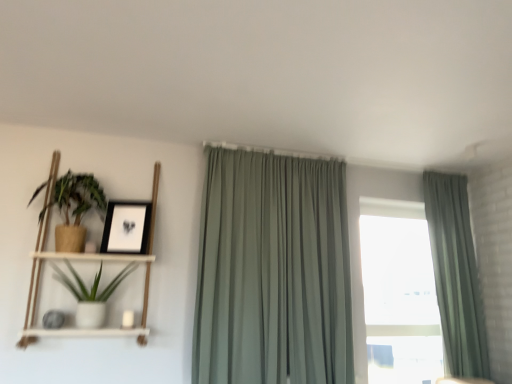
The height and width of the screenshot is (384, 512). What do you see at coordinates (126, 227) in the screenshot?
I see `matte black picture frame at upper left` at bounding box center [126, 227].

Measure the distance between matte brown pot at left, the 2th houseplant from the bottom, and camera.

matte brown pot at left, the 2th houseplant from the bottom, and camera are 8.24 feet apart.

Consider the image. In order to face white wood shelf at left, should I rotate leftwards or rightwards?

A 20.363 degree turn to the left will do.

The image size is (512, 384). I want to click on sage green fabric curtain at right, which is counted as the first curtain, starting from the right, so click(456, 275).

The height and width of the screenshot is (384, 512). Describe the element at coordinates (273, 272) in the screenshot. I see `sage green fabric curtain at center, acting as the second curtain starting from the right` at that location.

Image resolution: width=512 pixels, height=384 pixels. In order to click on sage green fabric curtain at center, acting as the second curtain starting from the right in this screenshot , I will do `click(273, 272)`.

I want to click on white matte pot at left, the 1th houseplant positioned from the bottom, so click(x=91, y=294).

Where is `matte black picture frame at upper left`? matte black picture frame at upper left is located at coordinates (126, 227).

From the picture: Is matte brown pot at left, positioned as the first houseplant in top-to-bottom order, oriented towards white wood shelf at left?

Yes.

At what (x,y) coordinates should I click in order to perform the action: click on shelf in front of the matte brown pot at left, positioned as the first houseplant in top-to-bottom order. Please return your answer as a coordinate pair (x, y). Looking at the image, I should click on (87, 260).

Considering the positions of point (78, 204) and point (99, 259), is point (78, 204) closer or farther from the camera than point (99, 259)?

Point (78, 204) is positioned farther from the camera compared to point (99, 259).

Considering the relative positions of matte brown pot at left, positioned as the first houseplant in top-to-bottom order, and white wood shelf at left in the image provided, is matte brown pot at left, positioned as the first houseplant in top-to-bottom order, to the right of white wood shelf at left from the viewer's perspective?

No.

Between matte brown pot at left, the 2th houseplant from the bottom, and sage green fabric curtain at right, which is counted as the first curtain, starting from the right, which one has less height?

Standing shorter between the two is matte brown pot at left, the 2th houseplant from the bottom.

Does matte brown pot at left, the 2th houseplant from the bottom, have a lesser width compared to sage green fabric curtain at right, which is counted as the first curtain, starting from the right?

In fact, matte brown pot at left, the 2th houseplant from the bottom, might be wider than sage green fabric curtain at right, which is counted as the first curtain, starting from the right.

Would you consider matte brown pot at left, positioned as the first houseplant in top-to-bottom order, to be distant from sage green fabric curtain at right, which is counted as the first curtain, starting from the right?

matte brown pot at left, positioned as the first houseplant in top-to-bottom order, is far away from sage green fabric curtain at right, which is counted as the first curtain, starting from the right.

Is sage green fabric curtain at right, which is counted as the first curtain, starting from the right, surrounded by matte brown pot at left, the 2th houseplant from the bottom?

No, sage green fabric curtain at right, which is counted as the first curtain, starting from the right, is not surrounded by matte brown pot at left, the 2th houseplant from the bottom.

From the image's perspective, between white matte pot at left, the 1th houseplant positioned from the bottom, and sage green fabric curtain at center, acting as the first curtain starting from the left, which one is located above?

sage green fabric curtain at center, acting as the first curtain starting from the left, is shown above in the image.

Is white matte pot at left, the 1th houseplant positioned from the bottom, oriented away from sage green fabric curtain at center, acting as the second curtain starting from the right?

No, white matte pot at left, the 1th houseplant positioned from the bottom, is not facing the opposite direction of sage green fabric curtain at center, acting as the second curtain starting from the right.

Can you see white matte pot at left, arranged as the 2th houseplant when viewed from the top, touching sage green fabric curtain at center, acting as the second curtain starting from the right?

No, white matte pot at left, arranged as the 2th houseplant when viewed from the top, is not touching sage green fabric curtain at center, acting as the second curtain starting from the right.

Which object is positioned more to the left, sage green fabric curtain at center, acting as the first curtain starting from the left, or white wood shelf at left?

white wood shelf at left.

Considering the sizes of objects sage green fabric curtain at center, acting as the first curtain starting from the left, and white wood shelf at left in the image provided, who is thinner, sage green fabric curtain at center, acting as the first curtain starting from the left, or white wood shelf at left?

white wood shelf at left is thinner.

Does sage green fabric curtain at center, acting as the first curtain starting from the left, contain white wood shelf at left?

Definitely not — white wood shelf at left is not inside sage green fabric curtain at center, acting as the first curtain starting from the left.

Is sage green fabric curtain at center, acting as the second curtain starting from the right, at the back of white wood shelf at left?

No, sage green fabric curtain at center, acting as the second curtain starting from the right, is not at the back of white wood shelf at left.

Which object is closer to the camera taking this photo, white wood shelf at left or sage green fabric curtain at center, acting as the first curtain starting from the left?

white wood shelf at left is more forward.

Considering the relative sizes of white wood shelf at left and sage green fabric curtain at center, acting as the second curtain starting from the right, in the image provided, is white wood shelf at left taller than sage green fabric curtain at center, acting as the second curtain starting from the right,?

Incorrect, the height of white wood shelf at left is not larger of that of sage green fabric curtain at center, acting as the second curtain starting from the right.

Is white wood shelf at left located outside matte brown pot at left, positioned as the first houseplant in top-to-bottom order?

Yes, white wood shelf at left is not within matte brown pot at left, positioned as the first houseplant in top-to-bottom order.

Does white wood shelf at left have a lesser height compared to matte brown pot at left, positioned as the first houseplant in top-to-bottom order?

No, white wood shelf at left is not shorter than matte brown pot at left, positioned as the first houseplant in top-to-bottom order.

Considering the relative sizes of white wood shelf at left and matte brown pot at left, positioned as the first houseplant in top-to-bottom order, in the image provided, is white wood shelf at left wider than matte brown pot at left, positioned as the first houseplant in top-to-bottom order,?

Incorrect, the width of white wood shelf at left does not surpass that of matte brown pot at left, positioned as the first houseplant in top-to-bottom order.

From the image's perspective, would you say white wood shelf at left is positioned over matte brown pot at left, the 2th houseplant from the bottom?

No, from the image's perspective, white wood shelf at left is not over matte brown pot at left, the 2th houseplant from the bottom.

Where is `shelf above the white matte pot at left, the 1th houseplant positioned from the bottom (from a real-world perspective)`? shelf above the white matte pot at left, the 1th houseplant positioned from the bottom (from a real-world perspective) is located at coordinates (87, 260).

Is white wood shelf at left to the left of white matte pot at left, the 1th houseplant positioned from the bottom, from the viewer's perspective?

Correct, you'll find white wood shelf at left to the left of white matte pot at left, the 1th houseplant positioned from the bottom.

Who is smaller, white wood shelf at left or white matte pot at left, arranged as the 2th houseplant when viewed from the top?

With smaller size is white matte pot at left, arranged as the 2th houseplant when viewed from the top.

The width and height of the screenshot is (512, 384). I want to click on shelf on the right side of matte brown pot at left, the 2th houseplant from the bottom, so click(x=87, y=260).

From the sage green fabric curtain at right, which is counted as the first curtain, starting from the right, count 1st houseplants forward and point to it. Please provide its 2D coordinates.

[(75, 208)]

Which object lies nearer to the anchor point sage green fabric curtain at right, placed as the second curtain when sorted from left to right, matte black picture frame at upper left or sage green fabric curtain at center, acting as the second curtain starting from the right?

sage green fabric curtain at center, acting as the second curtain starting from the right, is positioned closer to the anchor sage green fabric curtain at right, placed as the second curtain when sorted from left to right.

Considering their positions, is white matte pot at left, arranged as the 2th houseplant when viewed from the top, positioned closer to matte black picture frame at upper left than matte brown pot at left, the 2th houseplant from the bottom?

matte brown pot at left, the 2th houseplant from the bottom.

Which object lies further to the anchor point white matte pot at left, arranged as the 2th houseplant when viewed from the top, sage green fabric curtain at right, placed as the second curtain when sorted from left to right, or white wood shelf at left?

Among the two, sage green fabric curtain at right, placed as the second curtain when sorted from left to right, is located further to white matte pot at left, arranged as the 2th houseplant when viewed from the top.

From the image, which object appears to be nearer to matte brown pot at left, the 2th houseplant from the bottom, sage green fabric curtain at right, placed as the second curtain when sorted from left to right, or matte black picture frame at upper left?

Based on the image, matte black picture frame at upper left appears to be nearer to matte brown pot at left, the 2th houseplant from the bottom.

Based on the photo, when comparing their distances from sage green fabric curtain at right, placed as the second curtain when sorted from left to right, does sage green fabric curtain at center, acting as the second curtain starting from the right, or matte black picture frame at upper left seem further?

matte black picture frame at upper left is positioned further to the anchor sage green fabric curtain at right, placed as the second curtain when sorted from left to right.

Based on their spatial positions, is white wood shelf at left or sage green fabric curtain at right, which is counted as the first curtain, starting from the right, closer to matte black picture frame at upper left?

Based on the image, white wood shelf at left appears to be nearer to matte black picture frame at upper left.

Estimate the real-world distances between objects in this image. Which object is closer to matte brown pot at left, the 2th houseplant from the bottom, white wood shelf at left or sage green fabric curtain at center, acting as the second curtain starting from the right?

The object closer to matte brown pot at left, the 2th houseplant from the bottom, is white wood shelf at left.

Estimate the real-world distances between objects in this image. Which object is further from matte brown pot at left, positioned as the first houseplant in top-to-bottom order, matte black picture frame at upper left or white matte pot at left, the 1th houseplant positioned from the bottom?

white matte pot at left, the 1th houseplant positioned from the bottom, lies further to matte brown pot at left, positioned as the first houseplant in top-to-bottom order, than the other object.

Locate an element on the screen. picture frame between matte brown pot at left, the 2th houseplant from the bottom, and sage green fabric curtain at center, acting as the first curtain starting from the left, in the horizontal direction is located at coordinates (126, 227).

Locate an element on the screen. houseplant situated between matte brown pot at left, the 2th houseplant from the bottom, and sage green fabric curtain at center, acting as the first curtain starting from the left, from left to right is located at coordinates tap(91, 294).

The height and width of the screenshot is (384, 512). Identify the location of picture frame located between white matte pot at left, the 1th houseplant positioned from the bottom, and sage green fabric curtain at center, acting as the second curtain starting from the right, in the left-right direction. (126, 227).

At what (x,y) coordinates should I click in order to perform the action: click on picture frame between white matte pot at left, the 1th houseplant positioned from the bottom, and sage green fabric curtain at right, placed as the second curtain when sorted from left to right, in the horizontal direction. Please return your answer as a coordinate pair (x, y). This screenshot has width=512, height=384. Looking at the image, I should click on (126, 227).